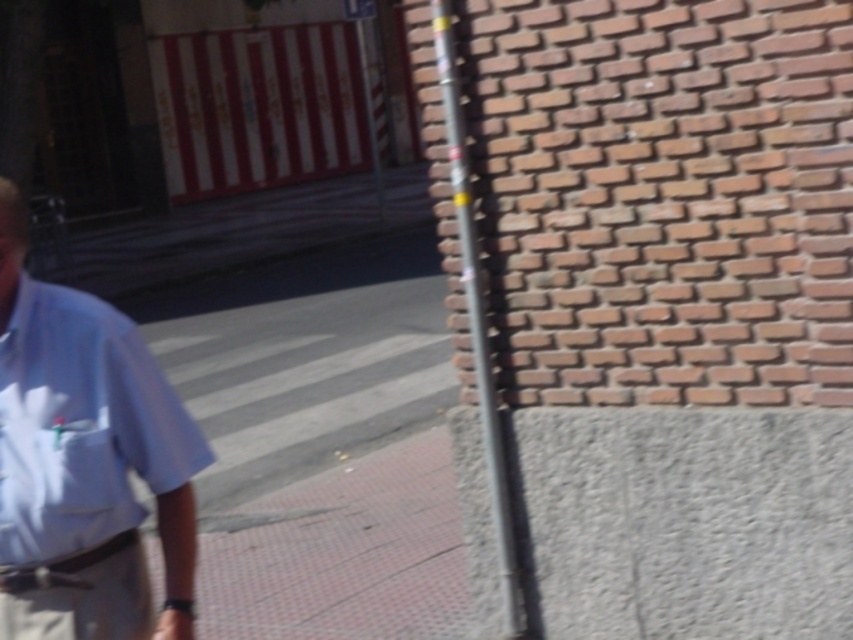
You are standing at the pedestrian crossing and want to determine which of the two points, point [15,589] or point [476,272], is closer to you. Based on the scene, which point is nearer?

Point [15,589] is closer to the viewer than point [476,272].